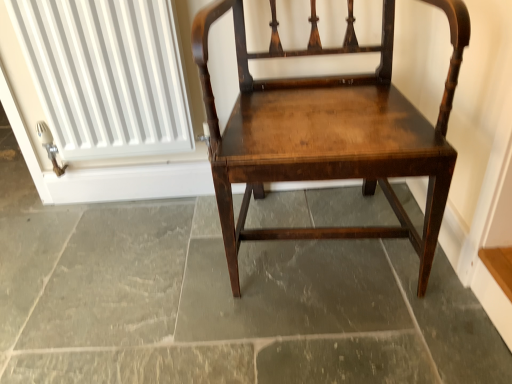
This screenshot has width=512, height=384. I want to click on free space in front of shiny dark wood chair at center, so click(344, 339).